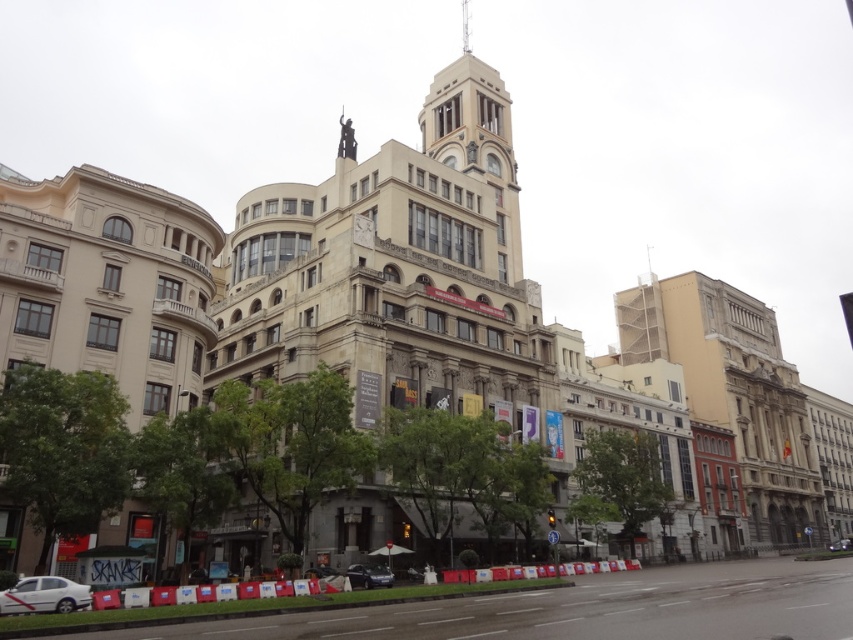
You are a delivery driver approaching the stone tower at center and the white matte car at lower left. Which object is positioned higher from the ground?

The stone tower at center is located above the white matte car at lower left, so it is positioned higher from the ground.